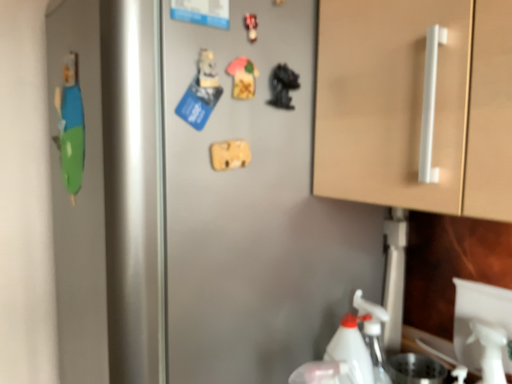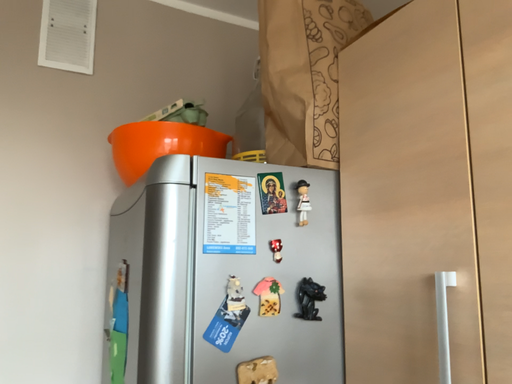
Question: Which way did the camera rotate in the video?

Choices:
 (A) rotated right
 (B) rotated left

Answer: (B)